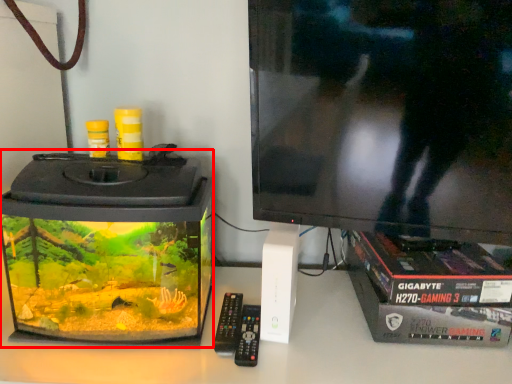
Question: From the image's perspective, what is the correct spatial relationship of appliance (annotated by the red box) in relation to control?

Choices:
 (A) below
 (B) above

Answer: (B)